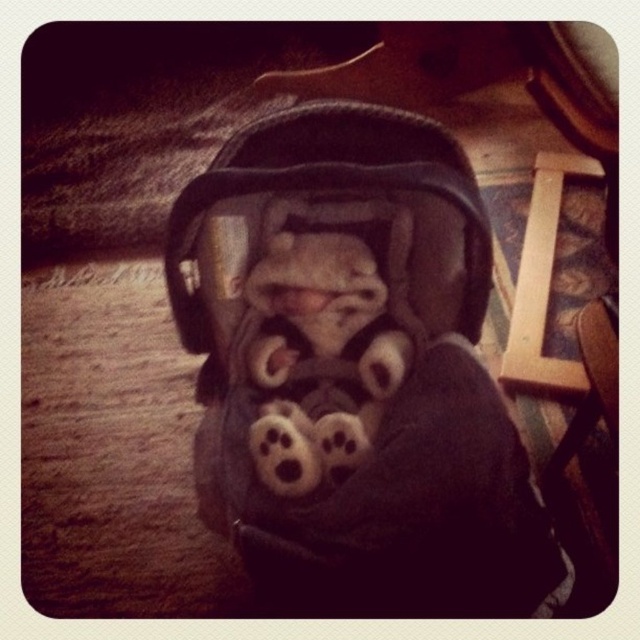
You are a parent checking the baby car seat. You notice the dark gray fabric baby carriage at center and the white plush toy at center. Which object is closer to you?

The dark gray fabric baby carriage at center is closer to the viewer than the white plush toy at center.

You are trying to place a small toy in the baby car seat. The car seat is at point (355,371). Where should you place the toy to ensure it stays secure?

The dark gray fabric baby carriage at center is represented by point (355,371). To ensure the toy stays secure, place it near the center point (355,371) where the car seat is located.